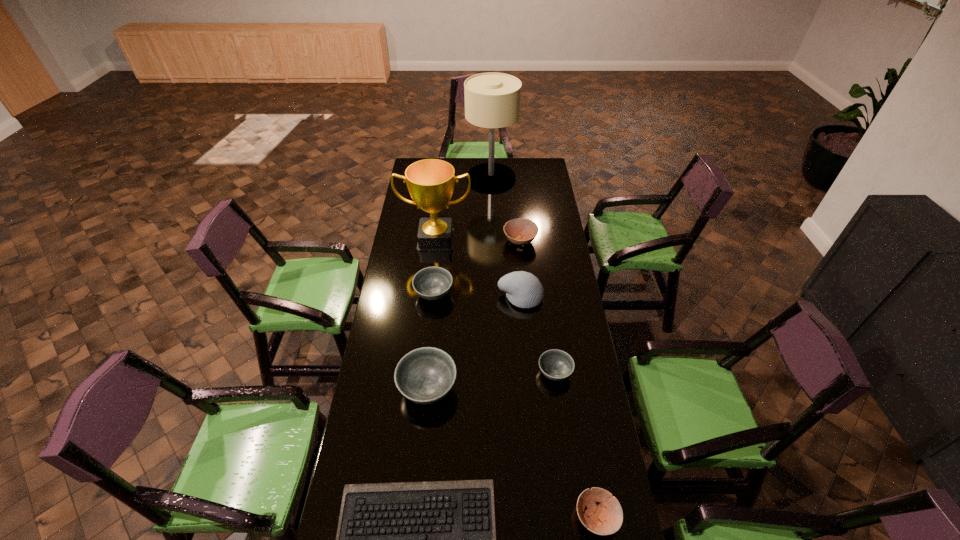
Identify the location of vacant space in between the tallest bowl and the farthest object. This screenshot has width=960, height=540. [460, 283].

The width and height of the screenshot is (960, 540). Identify the location of object that ranks as the sixth closest to the gray beanie. (437, 539).

Select which object appears as the fifth closest to the smaller brown bowl. Please provide its 2D coordinates. Your answer should be formatted as a tuple, i.e. [(x, y)], where the tuple contains the x and y coordinates of a point satisfying the conditions above.

[(432, 283)]

I want to click on bowl that is the fourth closest one to the award, so click(x=557, y=365).

Identify which bowl is located as the nearest to the computer keyboard. Please provide its 2D coordinates. Your answer should be formatted as a tuple, i.e. [(x, y)], where the tuple contains the x and y coordinates of a point satisfying the conditions above.

[(425, 375)]

Locate an element on the screen. The height and width of the screenshot is (540, 960). gray bowl that stands as the closest to the shortest object is located at coordinates 425,375.

Locate which gray bowl is the closest to the biggest gray bowl. Please provide its 2D coordinates. Your answer should be formatted as a tuple, i.e. [(x, y)], where the tuple contains the x and y coordinates of a point satisfying the conditions above.

[(432, 283)]

You are a GUI agent. You are given a task and a screenshot of the screen. Output one action in this format:
    pyautogui.click(x=<x>, y=<y>)
    Task: Click on the vacant space that satisfies the following two spatial constraints: 1. on the front-facing side of the eighth shortest object; 2. on the left side of the sixth shortest object
    The width and height of the screenshot is (960, 540).
    Given the screenshot: What is the action you would take?
    pyautogui.click(x=420, y=388)

This screenshot has width=960, height=540. I want to click on free space that satisfies the following two spatial constraints: 1. on the front-facing side of the farthest gray bowl; 2. on the right side of the award, so click(x=430, y=294).